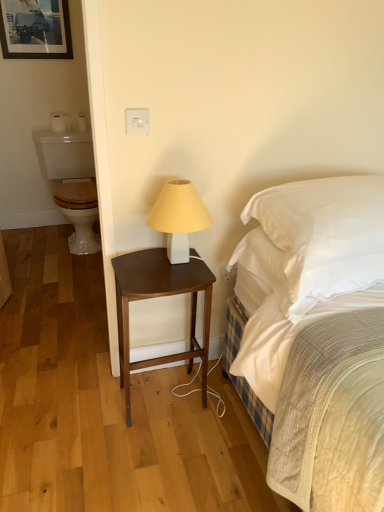
Locate an element on the screen. vacant region below white matte table lamp at center (from a real-world perspective) is located at coordinates click(183, 264).